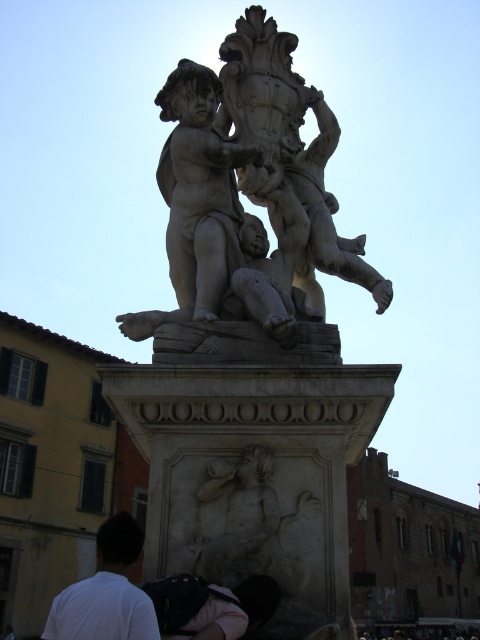
You are an art student analyzing the statue from the front. Which part of the statue, the white marble sculpture at upper center or the white marble cherub at center, is closer to you?

The white marble sculpture at upper center is closer to you because it is in front of the white marble cherub at center.

You are an art student who wants to sketch the statue. You have a sketchbook that can only accommodate objects within a 5 feet distance between the two main parts. Can you fit both the white marble sculpture at upper center and the white marble cherub at center in your sketchbook?

The white marble sculpture at upper center is 5.72 feet from the white marble cherub at center, which exceeds the 5 feet limit of the sketchbook. Therefore, you cannot fit both in your sketchbook.